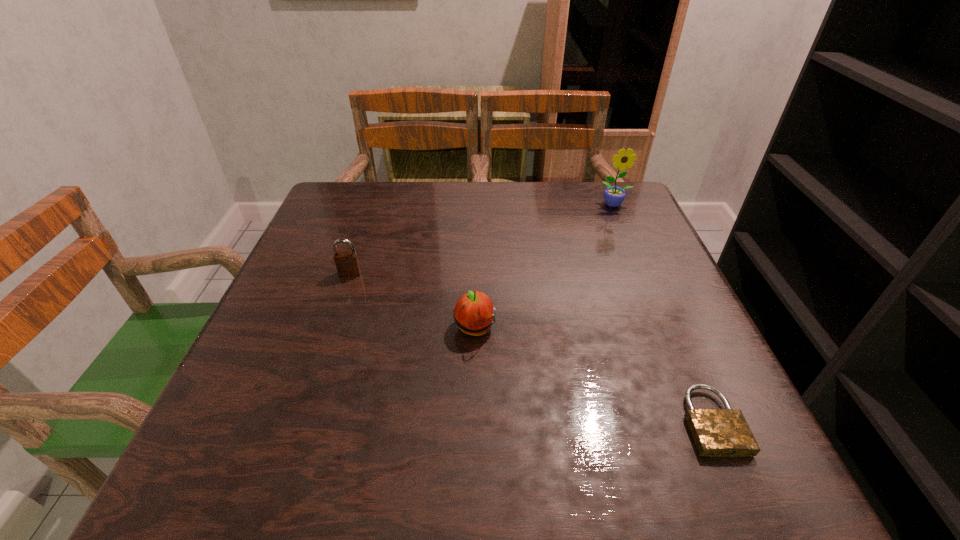
Image resolution: width=960 pixels, height=540 pixels. Identify the location of vacant position located 0.230m on the back of the third farthest object. (476, 243).

At what (x,y) coordinates should I click in order to perform the action: click on object positioned at the far edge. Please return your answer as a coordinate pair (x, y). This screenshot has width=960, height=540. Looking at the image, I should click on (614, 196).

Locate an element on the screen. Image resolution: width=960 pixels, height=540 pixels. object situated at the near edge is located at coordinates (716, 432).

Where is `object that is positioned at the left edge`? object that is positioned at the left edge is located at coordinates (347, 263).

The image size is (960, 540). I want to click on sunflower situated at the right edge, so click(x=614, y=196).

Locate an element on the screen. The height and width of the screenshot is (540, 960). padlock that is at the right edge is located at coordinates (716, 432).

What are the coordinates of `object that is at the far right corner` in the screenshot? It's located at (614, 196).

The image size is (960, 540). I want to click on object present at the near right corner, so tap(716, 432).

Locate an element on the screen. vacant space at the far edge is located at coordinates (463, 198).

Find the location of a particular element. This screenshot has height=540, width=960. free space at the near edge of the desktop is located at coordinates (622, 442).